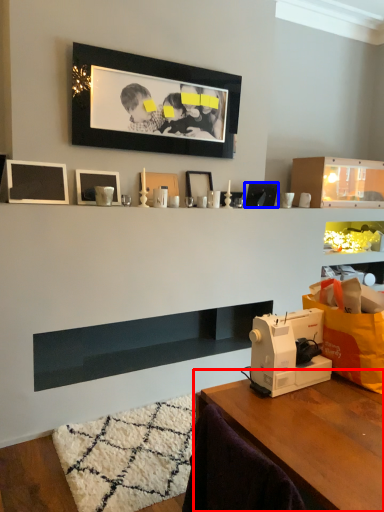
Question: Which object is further to the camera taking this photo, table (highlighted by a red box) or picture frame (highlighted by a blue box)?

Choices:
 (A) table
 (B) picture frame

Answer: (B)